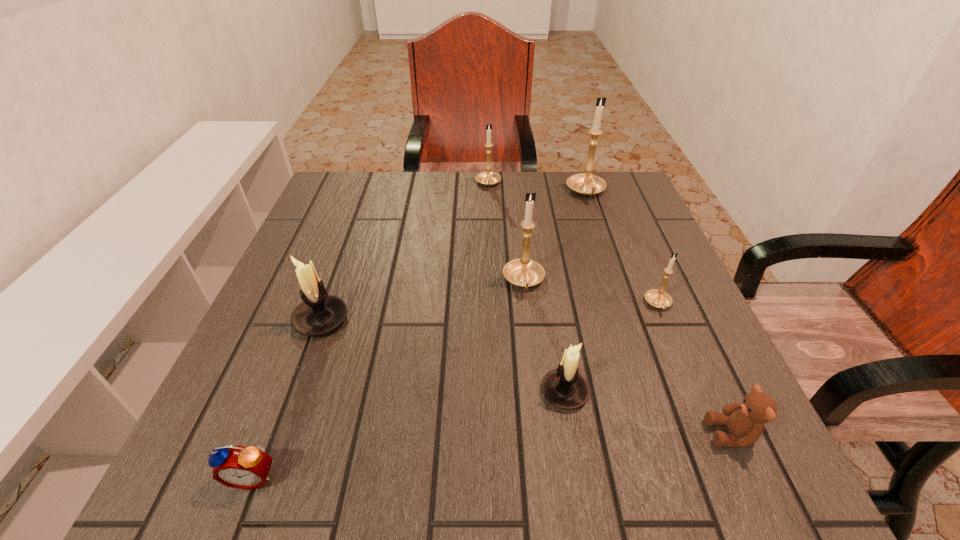
You are a GUI agent. You are given a task and a screenshot of the screen. Output one action in this format:
    pyautogui.click(x=<x>, y=<y>)
    Task: Click on the object at the near right corner
    
    Given the screenshot: What is the action you would take?
    pyautogui.click(x=745, y=421)

In the image, there is a desktop. Where is `vacant space at the far edge`? vacant space at the far edge is located at coordinates (552, 194).

Where is `blank space at the left edge of the desktop`? blank space at the left edge of the desktop is located at coordinates (356, 249).

Find the location of `free space at the right edge of the desktop`. free space at the right edge of the desktop is located at coordinates click(650, 240).

In the image, there is a desktop. Where is `free space at the far left corner`? free space at the far left corner is located at coordinates (331, 179).

The width and height of the screenshot is (960, 540). Find the location of `vacant space at the far right corner of the desktop`. vacant space at the far right corner of the desktop is located at coordinates (593, 207).

In order to click on vacant area that lies between the smallest gold candle holder and the nearest object in this screenshot , I will do click(456, 390).

Identify the location of vacant space in between the alarm clock and the biggest gold candle holder. This screenshot has width=960, height=540. (420, 334).

At what (x,y) coordinates should I click in order to perform the action: click on free space between the biggest gold candle holder and the brown teddy bear. Please return your answer as a coordinate pair (x, y). Looking at the image, I should click on (659, 313).

At what (x,y) coordinates should I click in order to perform the action: click on free space that is in between the third biggest gold candle holder and the tallest candle holder. Please return your answer as a coordinate pair (x, y). Looking at the image, I should click on [538, 188].